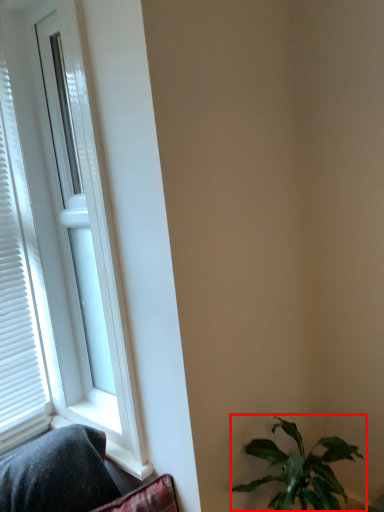
Question: From the image's perspective, where is houseplant (annotated by the red box) located relative to window?

Choices:
 (A) above
 (B) below

Answer: (B)